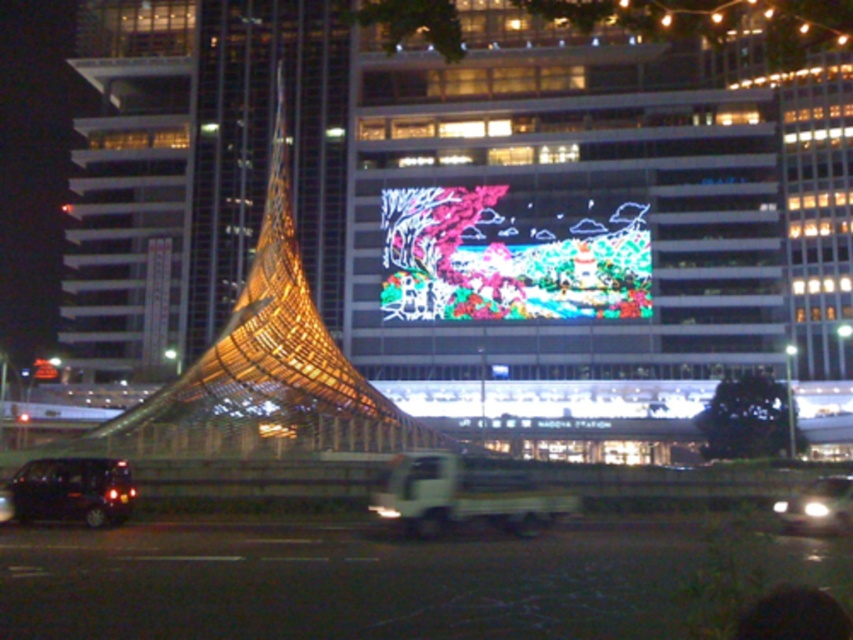
Question: Among these objects, which one is nearest to the camera?

Choices:
 (A) glassy reflective tower at left
 (B) black rubber car at lower left
 (C) shiny black car at lower left
 (D) shiny silver car at lower right

Answer: (D)

Question: Which object is the farthest from the glassy reflective tower at left?

Choices:
 (A) shiny black car at lower left
 (B) black rubber car at lower left
 (C) shiny silver car at lower right

Answer: (C)

Question: Can you confirm if glassy reflective tower at left is positioned to the right of shiny silver car at lower right?

Choices:
 (A) no
 (B) yes

Answer: (A)

Question: Where is glassy reflective tower at left located in relation to shiny silver car at lower right in the image?

Choices:
 (A) below
 (B) above

Answer: (B)

Question: Which object appears closest to the camera in this image?

Choices:
 (A) glassy reflective tower at left
 (B) black rubber car at lower left
 (C) shiny black car at lower left

Answer: (B)

Question: Can you confirm if glassy reflective tower at left is positioned above shiny black car at lower left?

Choices:
 (A) yes
 (B) no

Answer: (A)